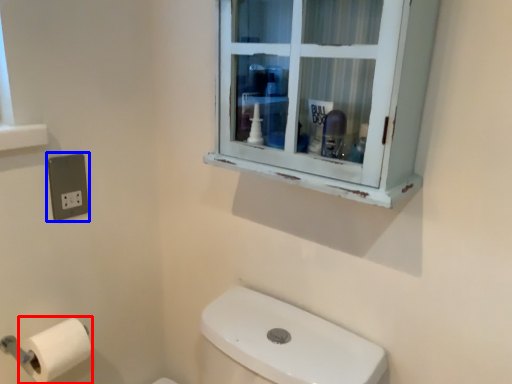
Question: Among these objects, which one is nearest to the camera, toilet paper (highlighted by a red box) or electric outlet (highlighted by a blue box)?

Choices:
 (A) toilet paper
 (B) electric outlet

Answer: (A)